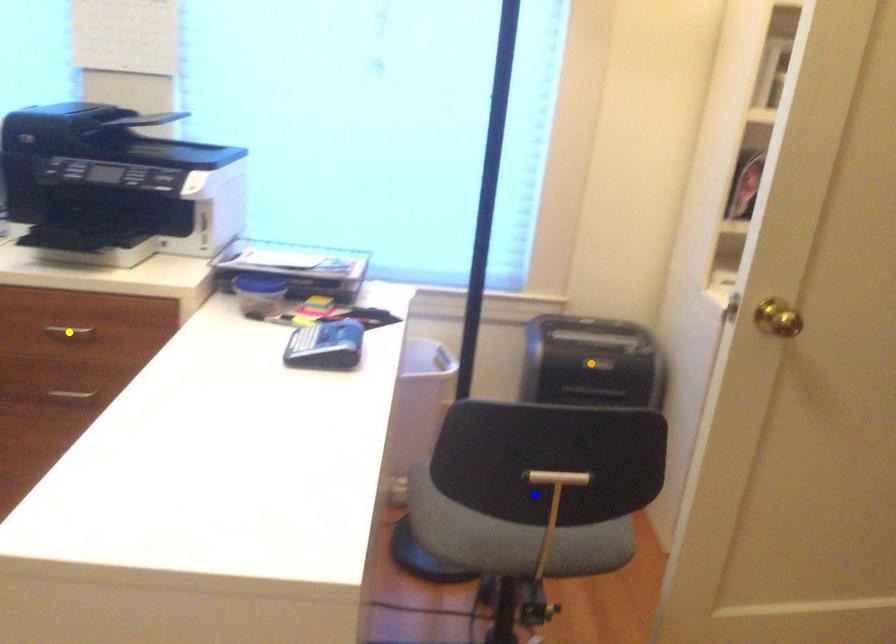
Order these from nearest to farthest:
orange point | blue point | yellow point

blue point, yellow point, orange point